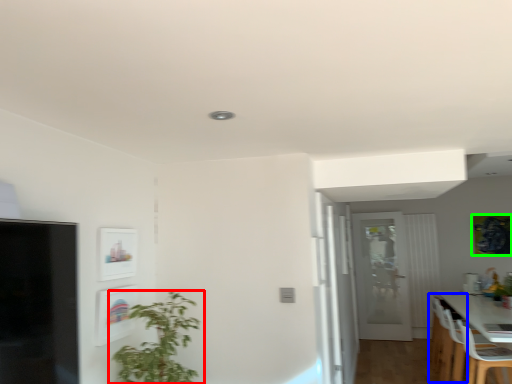
Question: Considering the real-world distances, which object is farthest from houseplant (highlighted by a red box)? chair (highlighted by a blue box) or picture frame (highlighted by a green box)?

Choices:
 (A) chair
 (B) picture frame

Answer: (B)